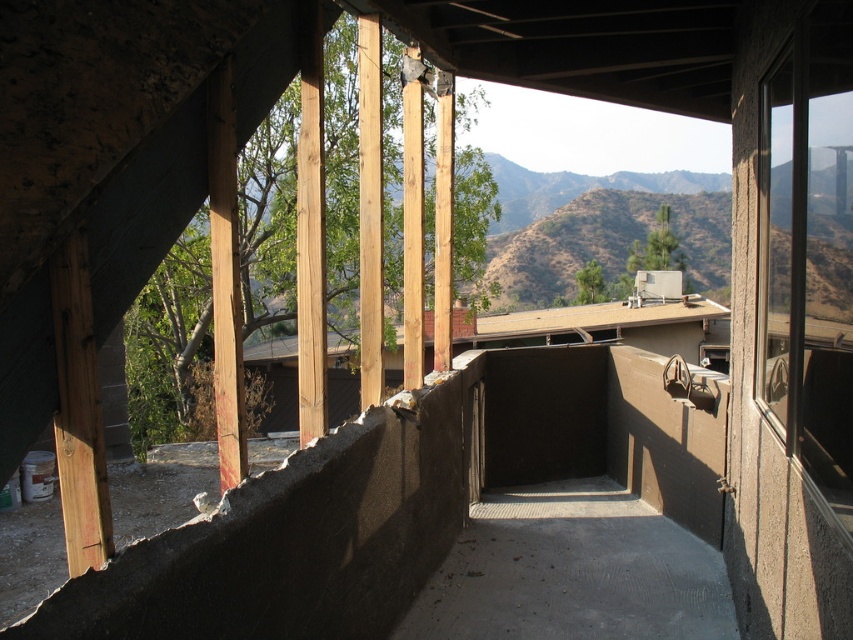
You are an architect inspecting a construction site. You notice two beams in the center of the structure. The first is labeled as the natural wood beam at center, and the second is the brown wooden beam at center. Which beam is shorter in height?

The natural wood beam at center has a lesser height compared to the brown wooden beam at center, so the natural wood beam at center is shorter in height.

You are an architect inspecting a construction site. You notice two beams at the center of the structure. Which beam would require more material to construct, the natural wood beam at center or the brown wooden beam at center?

The natural wood beam at center has a larger size compared to the brown wooden beam at center, so it would require more material to construct.